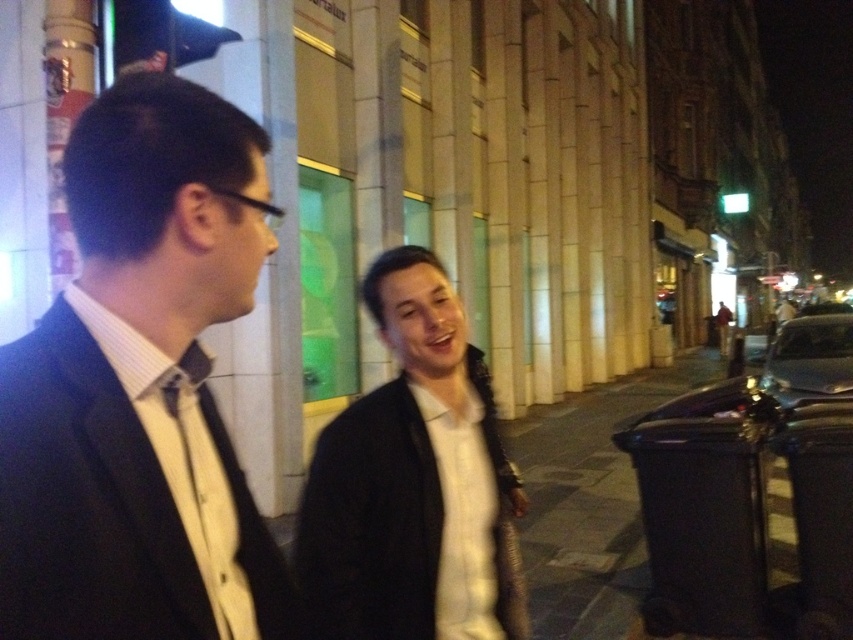
Question: Among these points, which one is farthest from the camera?

Choices:
 (A) (498, 440)
 (B) (207, 99)
 (C) (222, 480)

Answer: (A)

Question: Can you confirm if black matte suit at left is bigger than white matte jacket at center?

Choices:
 (A) no
 (B) yes

Answer: (A)

Question: Can you confirm if black matte suit at left is positioned above white matte jacket at center?

Choices:
 (A) no
 (B) yes

Answer: (B)

Question: Is white matte jacket at center positioned in front of matte black bow tie at center?

Choices:
 (A) yes
 (B) no

Answer: (B)

Question: Which point appears farthest from the camera in this image?

Choices:
 (A) (221, 480)
 (B) (398, 531)
 (C) (38, 582)

Answer: (B)

Question: Which point is farther to the camera?

Choices:
 (A) white matte jacket at center
 (B) matte black bow tie at center
 (C) black matte suit at left

Answer: (A)